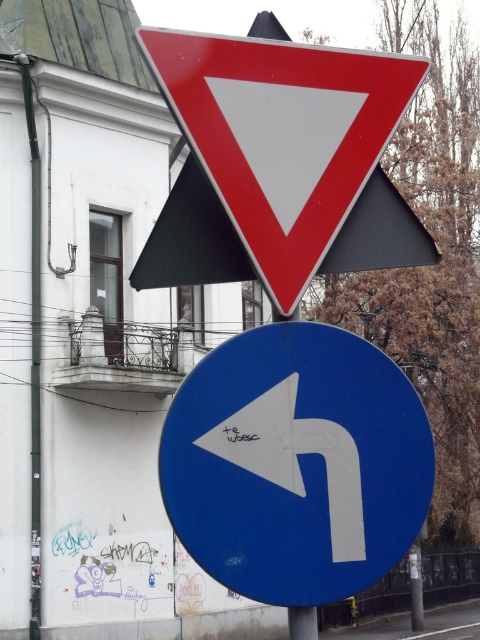
Question: Among these points, which one is farthest from the camera?

Choices:
 (A) (386, 260)
 (B) (263, 451)

Answer: (A)

Question: Can you confirm if blue glossy arrow at center is positioned to the right of metallic red triangle at upper center?

Choices:
 (A) no
 (B) yes

Answer: (B)

Question: Which object is the farthest from the metallic red triangle at upper center?

Choices:
 (A) blue glossy arrow at center
 (B) white matte arrow at center

Answer: (A)

Question: Which object is farther from the camera taking this photo?

Choices:
 (A) metallic red triangle at upper center
 (B) white matte arrow at center

Answer: (B)

Question: Is blue glossy arrow at center to the left of metallic red triangle at upper center from the viewer's perspective?

Choices:
 (A) no
 (B) yes

Answer: (A)

Question: Is blue glossy arrow at center smaller than white matte arrow at center?

Choices:
 (A) yes
 (B) no

Answer: (B)